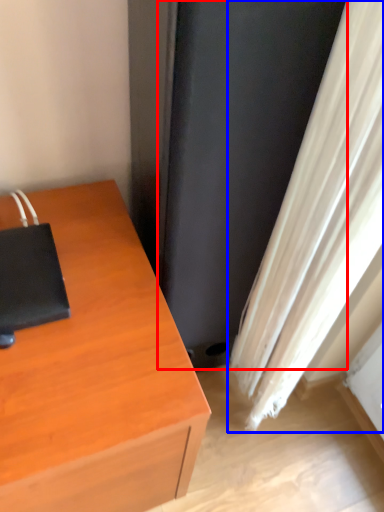
Question: Which object is further to the camera taking this photo, screen door (highlighted by a red box) or curtain (highlighted by a blue box)?

Choices:
 (A) screen door
 (B) curtain

Answer: (A)